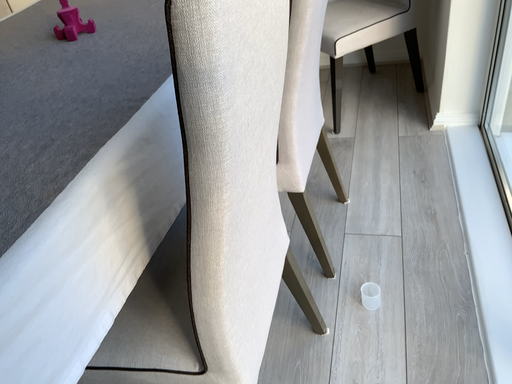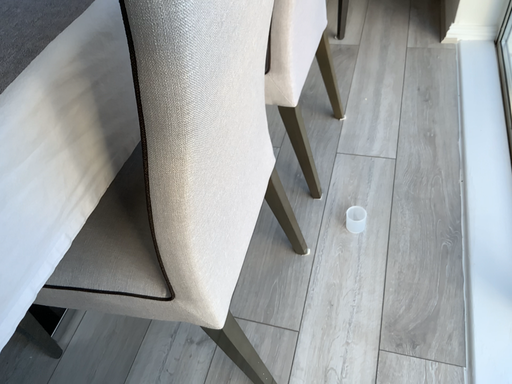
Question: How did the camera likely rotate when shooting the video?

Choices:
 (A) rotated downward
 (B) rotated upward

Answer: (A)